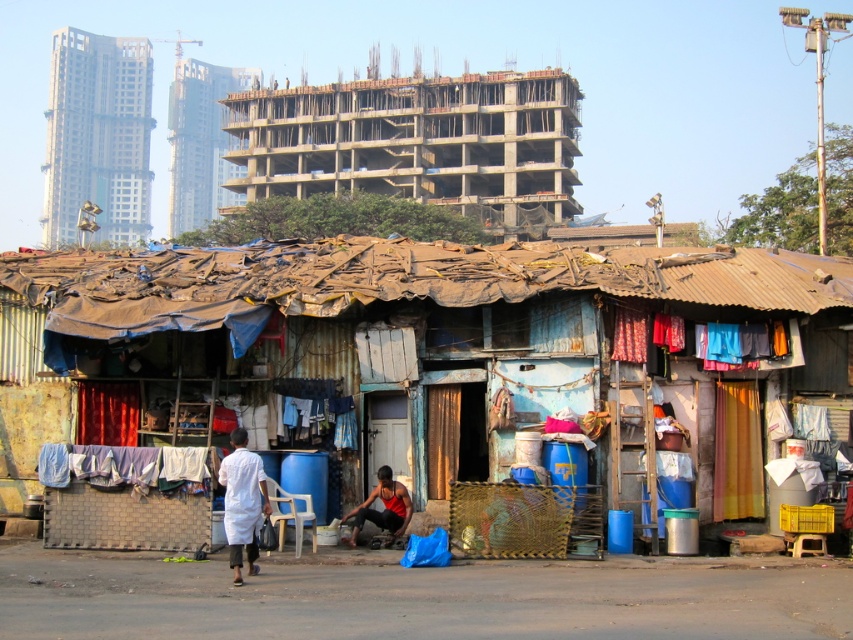
Question: Which of the following is the farthest from the observer?

Choices:
 (A) (756, 337)
 (B) (131, 468)
 (C) (257, 132)

Answer: (C)

Question: Is rusty corrugated hut at center wider than white fabric at lower left?

Choices:
 (A) yes
 (B) no

Answer: (A)

Question: Which object appears farthest from the camera in this image?

Choices:
 (A) white fabric at lower left
 (B) white cloth at center
 (C) concrete building at upper center
 (D) red fabric shirt at lower center

Answer: (C)

Question: Based on their relative distances, which object is nearer to the white cloth at center?

Choices:
 (A) concrete building at upper center
 (B) red fabric shirt at lower center
 (C) rusty corrugated hut at center

Answer: (B)

Question: Observing the image, what is the correct spatial positioning of rusty corrugated hut at center in reference to white cloth at center?

Choices:
 (A) above
 (B) below

Answer: (A)

Question: Is rusty corrugated hut at center wider than white cloth at center?

Choices:
 (A) yes
 (B) no

Answer: (A)